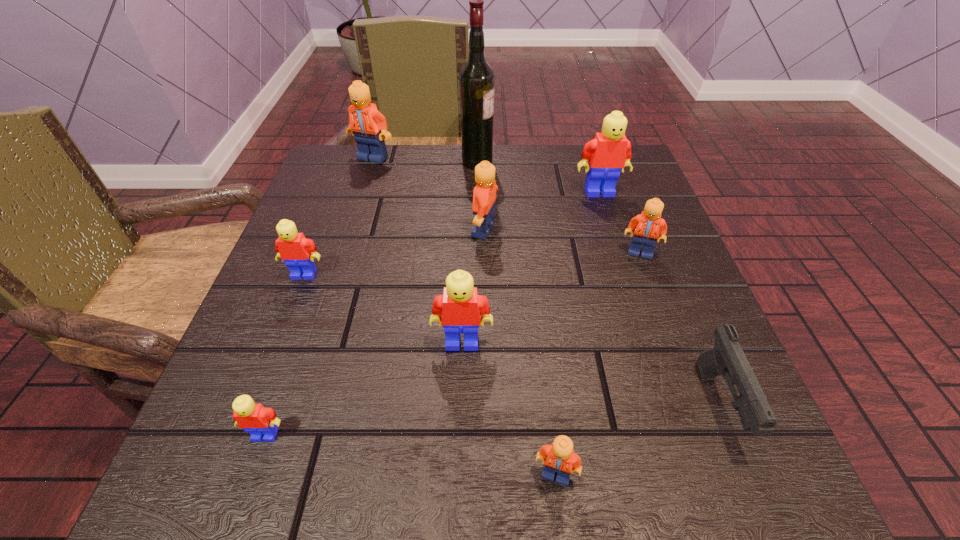
What are the coordinates of `the fifth nearest object` in the screenshot? It's located at (298, 252).

The image size is (960, 540). I want to click on pistol, so click(x=727, y=358).

Where is `the third orange Lego from left to right`? the third orange Lego from left to right is located at coordinates (560, 457).

Where is `the nearest object`? This screenshot has height=540, width=960. the nearest object is located at coordinates (560, 457).

Identify the location of the seventh farthest Lego. The image size is (960, 540). (254, 418).

Find the location of a particular element. the smallest yellow Lego is located at coordinates (254, 418).

Locate an element on the screen. free space located 0.110m on the front and back of the tallest object is located at coordinates (540, 161).

Image resolution: width=960 pixels, height=540 pixels. What are the coordinates of `vacant space located on the front-facing side of the biggest orange Lego` in the screenshot? It's located at (367, 176).

Where is `free spot located on the front-facing side of the rightmost yellow Lego`? The width and height of the screenshot is (960, 540). free spot located on the front-facing side of the rightmost yellow Lego is located at coordinates (633, 295).

Locate an element on the screen. This screenshot has height=540, width=960. blank space located 0.170m on the front-facing side of the third smallest orange Lego is located at coordinates (385, 230).